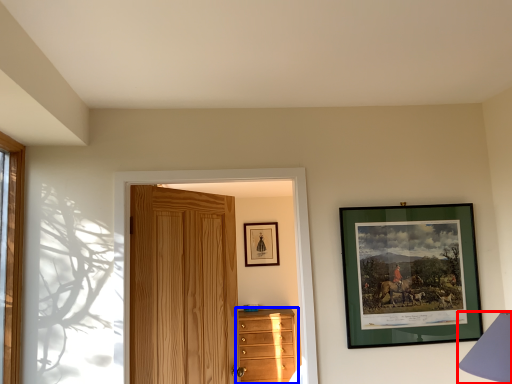
Question: Which object is closer to the camera taking this photo, table lamp (highlighted by a red box) or chest of drawers (highlighted by a blue box)?

Choices:
 (A) table lamp
 (B) chest of drawers

Answer: (A)